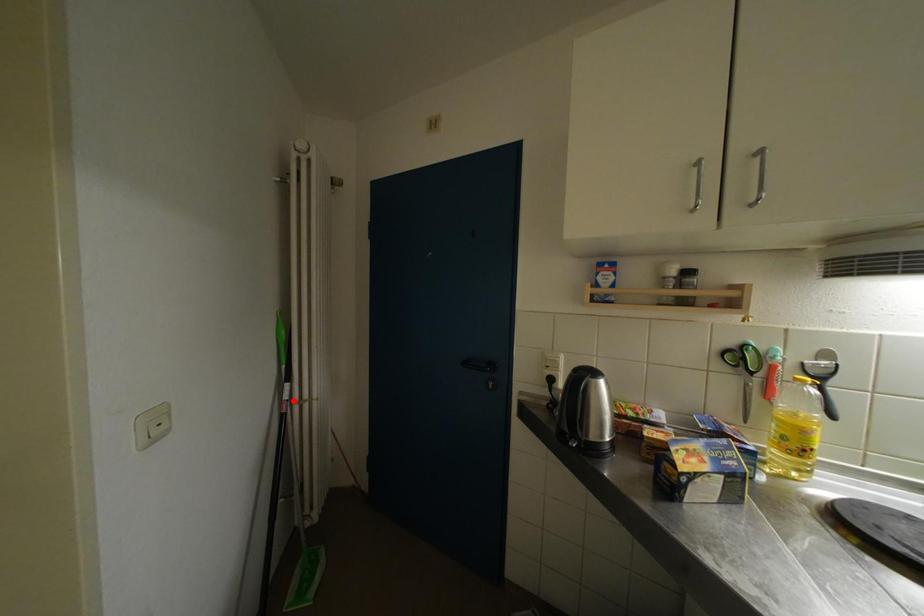
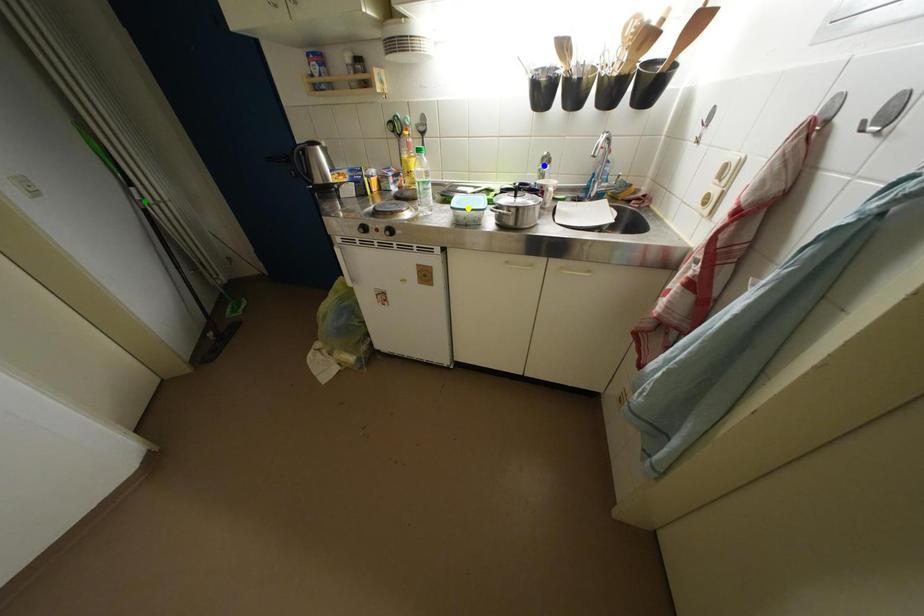
Question: I am providing you with two images of the same scene from different viewpoints. A red point is marked on the first image. You are given multiple points on the second image. Can you choose the point in image 2 that corresponds to the point in image 1?

Choices:
 (A) blue point
 (B) green point
 (C) yellow point

Answer: (B)